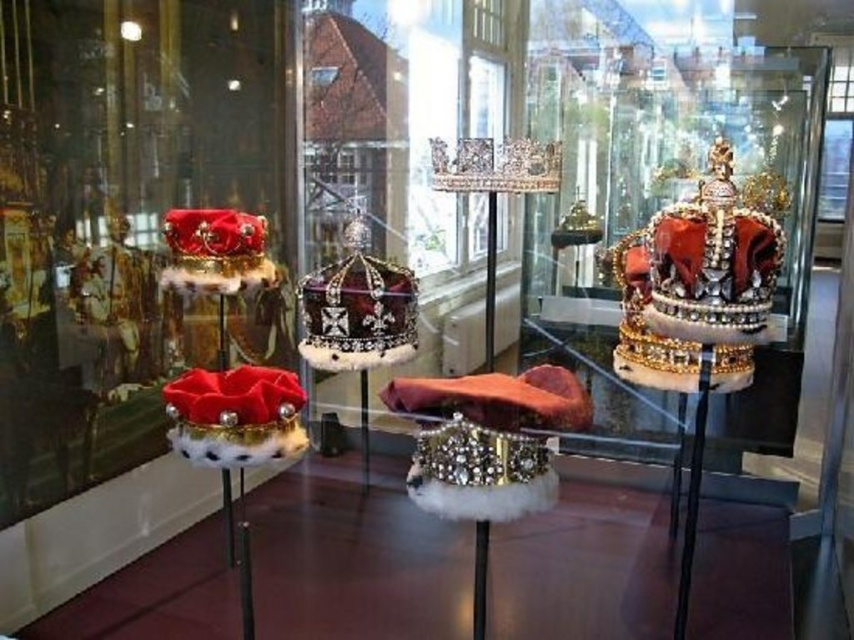
Question: Is shiny gold crown at right below satin black crown at center?

Choices:
 (A) yes
 (B) no

Answer: (B)

Question: Which object appears farthest from the camera in this image?

Choices:
 (A) satin black crown at center
 (B) shiny gold crown at right

Answer: (A)

Question: Which point appears farthest from the camera in this image?

Choices:
 (A) (752, 308)
 (B) (367, 301)

Answer: (B)

Question: Among these points, which one is nearest to the camera?

Choices:
 (A) (683, 248)
 (B) (396, 307)

Answer: (A)

Question: Is the position of shiny gold crown at right less distant than that of satin black crown at center?

Choices:
 (A) yes
 (B) no

Answer: (A)

Question: Is shiny gold crown at right positioned before satin black crown at center?

Choices:
 (A) yes
 (B) no

Answer: (A)